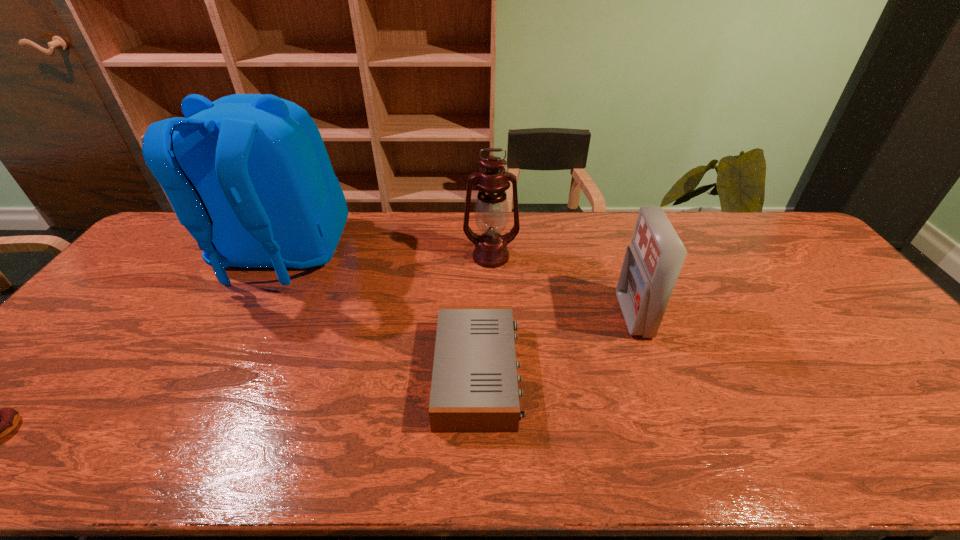
At what (x,y) coordinates should I click in order to perform the action: click on free space between the third shortest object and the second shortest object. Please return your answer as a coordinate pair (x, y). The image size is (960, 540). Looking at the image, I should click on (556, 345).

In order to click on free spot between the first-aid kit and the fourth tallest object in this screenshot , I will do `click(556, 345)`.

Find the location of a particular element. This screenshot has height=540, width=960. vacant region between the third shortest object and the second shortest object is located at coordinates (556, 345).

Where is `unoccupied position between the first-aid kit and the fourth object from right to left`? unoccupied position between the first-aid kit and the fourth object from right to left is located at coordinates (457, 286).

Identify which object is located as the fourth nearest to the second shortest object. Please provide its 2D coordinates. Your answer should be formatted as a tuple, i.e. [(x, y)], where the tuple contains the x and y coordinates of a point satisfying the conditions above.

[(9, 417)]

Find the location of a particular element. Image resolution: width=960 pixels, height=540 pixels. the third closest object relative to the doughnut is located at coordinates (491, 211).

I want to click on vacant space that satisfies the following two spatial constraints: 1. on the back of the backpack; 2. on the right side of the fourth shortest object, so click(280, 256).